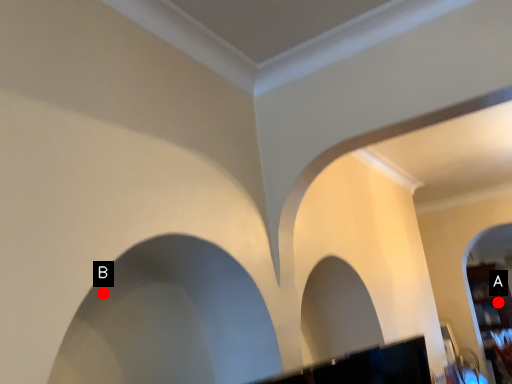
Question: Two points are circled on the image, labeled by A and B beside each circle. Among these points, which one is farthest from the camera?

Choices:
 (A) A is further
 (B) B is further

Answer: (A)